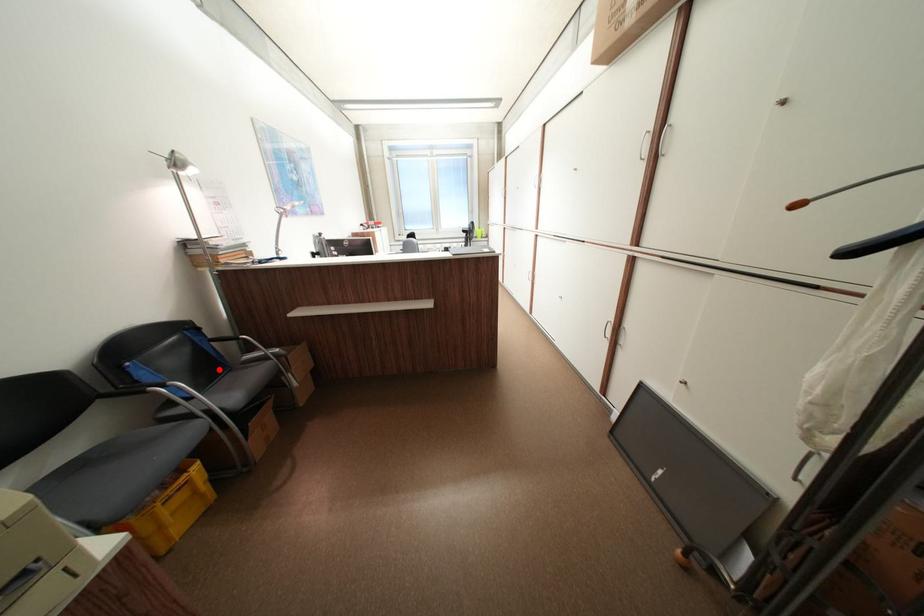
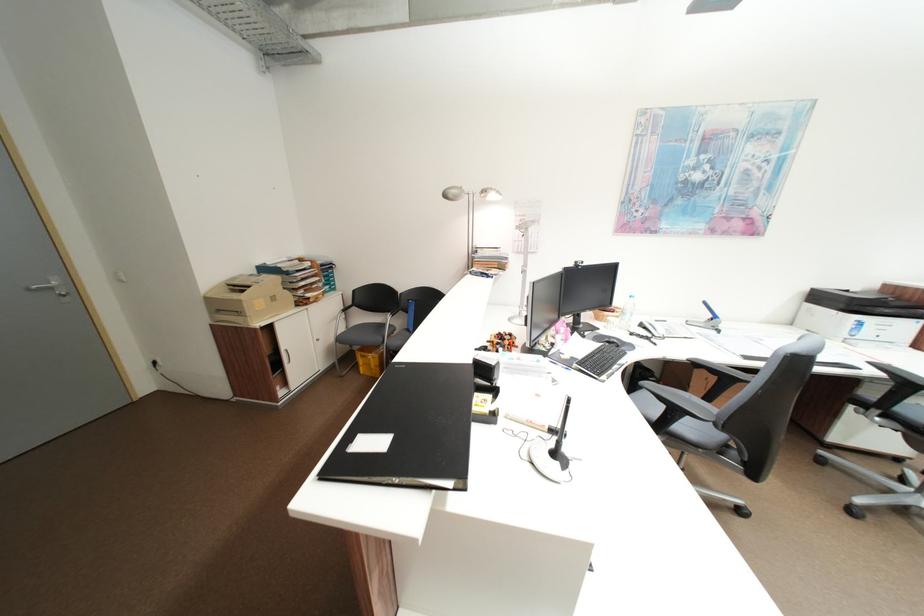
Question: I am providing you with two images of the same scene from different viewpoints. A red point is marked on the first image. At the location where the point appears in image 1, is it still visible in image 2?

Choices:
 (A) Yes
 (B) No

Answer: (B)